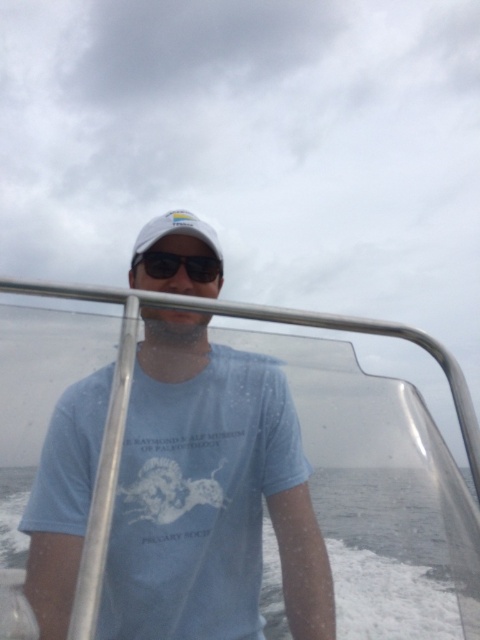
Question: From the image, what is the correct spatial relationship of white foam at lower center in relation to white matte baseball cap at center?

Choices:
 (A) below
 (B) above

Answer: (A)

Question: Can you confirm if matte white cap at center is wider than black plastic goggles at center?

Choices:
 (A) yes
 (B) no

Answer: (A)

Question: Among these points, which one is nearest to the camera?

Choices:
 (A) (151, 225)
 (B) (146, 266)

Answer: (B)

Question: Which object appears farthest from the camera in this image?

Choices:
 (A) white foam at lower center
 (B) black plastic goggles at center
 (C) matte white cap at center

Answer: (B)

Question: Estimate the real-world distances between objects in this image. Which object is farther from the matte white cap at center?

Choices:
 (A) white foam at lower center
 (B) white matte baseball cap at center

Answer: (A)

Question: Can you confirm if white matte baseball cap at center is positioned to the right of black plastic goggles at center?

Choices:
 (A) no
 (B) yes

Answer: (A)